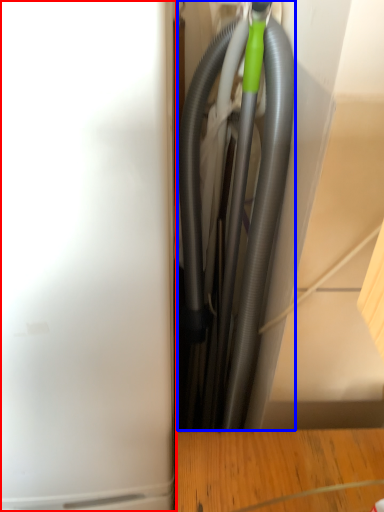
Question: Which of the following is the farthest to the observer, appliance (highlighted by a red box) or garden hose (highlighted by a blue box)?

Choices:
 (A) appliance
 (B) garden hose

Answer: (B)